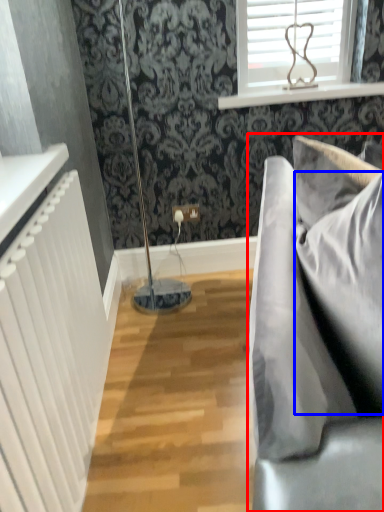
Question: Which point is further to the camera, studio couch (highlighted by a red box) or pillow (highlighted by a blue box)?

Choices:
 (A) studio couch
 (B) pillow

Answer: (B)